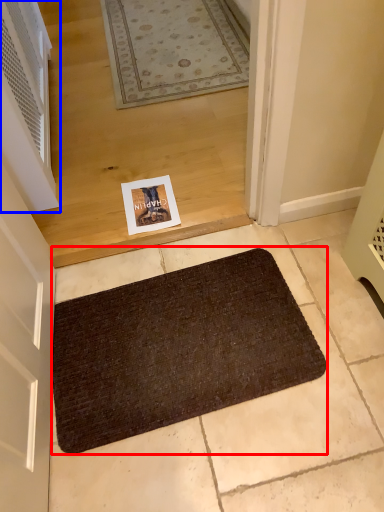
Question: Which object appears closest to the camera in this image, bath mat (highlighted by a red box) or air conditioner (highlighted by a blue box)?

Choices:
 (A) bath mat
 (B) air conditioner

Answer: (A)